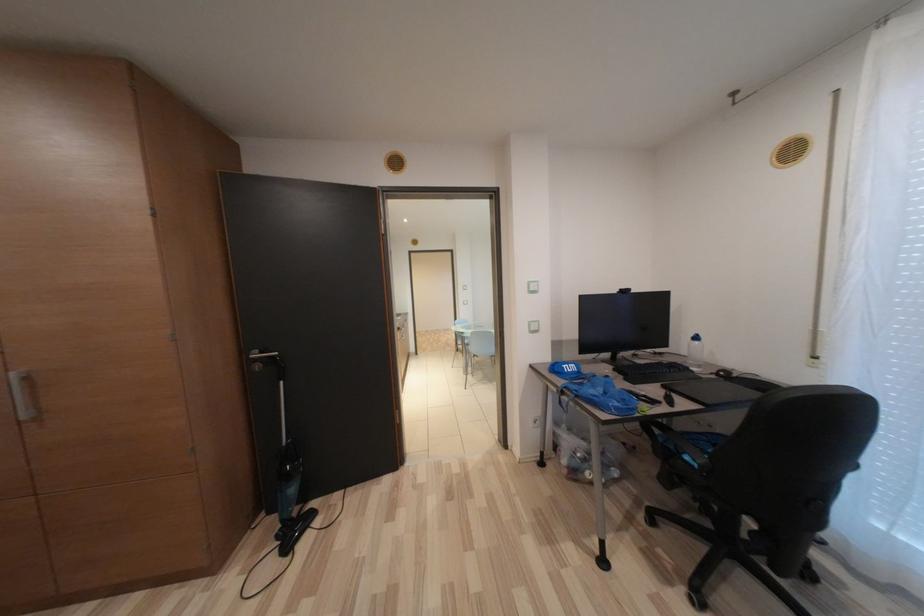
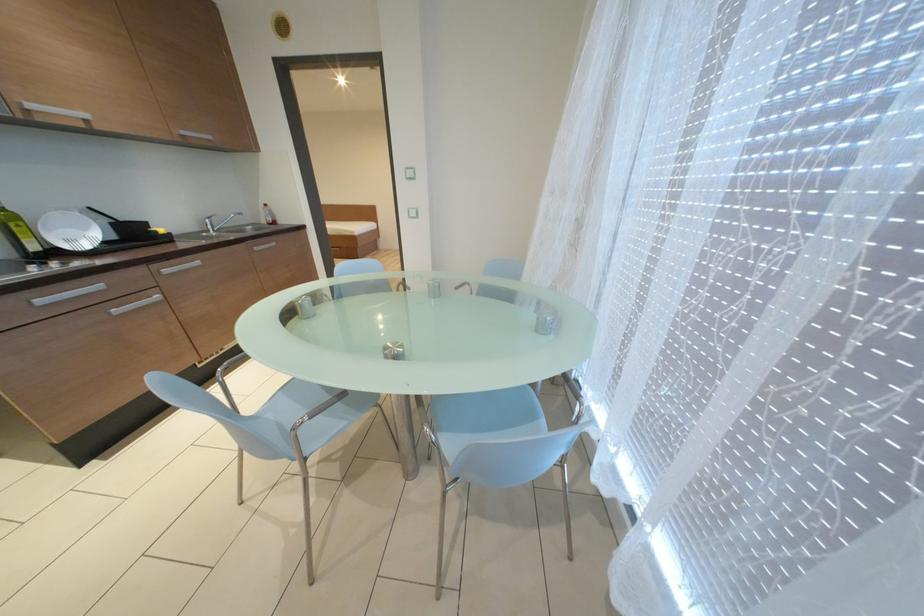
The images are taken continuously from a first-person perspective. In which direction are you moving?

The cameraman walked toward right, forward.